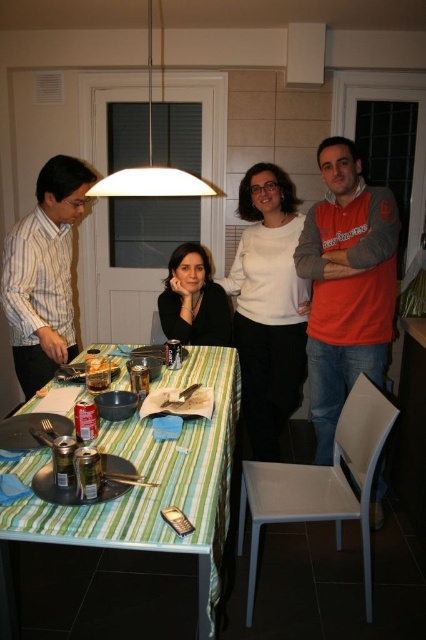
Is white matte sweater at center closer to camera compared to shiny metallic can at table center?

That is False.

Does point (305, 374) lie behind point (95, 371)?

That is True.

What are the coordinates of `white matte sweater at center` in the screenshot? It's located at (268, 307).

The width and height of the screenshot is (426, 640). Identify the location of white matte lampshade at upper center. (150, 163).

Is white matte lampshade at upper center to the right of shiny metallic can at table center from the viewer's perspective?

Indeed, white matte lampshade at upper center is positioned on the right side of shiny metallic can at table center.

Between point (101, 179) and point (88, 372), which one is positioned behind?

The point (101, 179) is behind.

At what (x,y) coordinates should I click in order to perform the action: click on white matte lampshade at upper center. Please return your answer as a coordinate pair (x, y). This screenshot has width=426, height=640. Looking at the image, I should click on (150, 163).

Which is more to the left, orange fleece jacket at right or white matte lampshade at upper center?

From the viewer's perspective, white matte lampshade at upper center appears more on the left side.

In order to click on orange fleece jacket at right in this screenshot , I will do `click(347, 285)`.